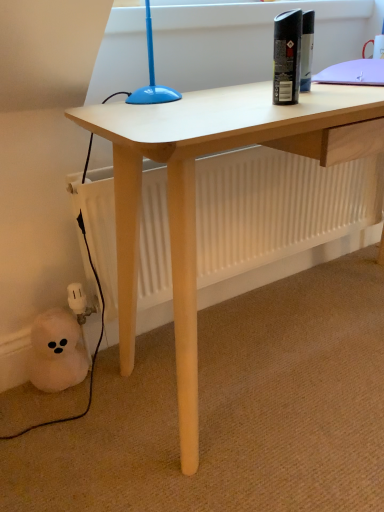
Question: From a real-world perspective, is black matte spray can at upper right over black rubber cable at lower left?

Choices:
 (A) no
 (B) yes

Answer: (B)

Question: Is black matte spray can at upper right shorter than black rubber cable at lower left?

Choices:
 (A) no
 (B) yes

Answer: (B)

Question: Is black matte spray can at upper right positioned far away from black rubber cable at lower left?

Choices:
 (A) yes
 (B) no

Answer: (B)

Question: Is black matte spray can at upper right oriented away from black rubber cable at lower left?

Choices:
 (A) yes
 (B) no

Answer: (B)

Question: Considering the relative positions of black matte spray can at upper right and black rubber cable at lower left in the image provided, is black matte spray can at upper right behind black rubber cable at lower left?

Choices:
 (A) yes
 (B) no

Answer: (B)

Question: From a real-world perspective, is black matte spray can at upper right below black rubber cable at lower left?

Choices:
 (A) no
 (B) yes

Answer: (A)

Question: Can you confirm if black rubber cable at lower left is wider than black matte spray can at upper right?

Choices:
 (A) yes
 (B) no

Answer: (A)

Question: Is black rubber cable at lower left bigger than black matte spray can at upper right?

Choices:
 (A) no
 (B) yes

Answer: (B)

Question: Is black rubber cable at lower left to the right of black matte spray can at upper right from the viewer's perspective?

Choices:
 (A) yes
 (B) no

Answer: (B)

Question: Can you confirm if black rubber cable at lower left is positioned to the left of black matte spray can at upper right?

Choices:
 (A) yes
 (B) no

Answer: (A)

Question: Is black rubber cable at lower left positioned with its back to black matte spray can at upper right?

Choices:
 (A) yes
 (B) no

Answer: (B)

Question: Does black rubber cable at lower left lie in front of black matte spray can at upper right?

Choices:
 (A) yes
 (B) no

Answer: (B)

Question: Considering the positions of point (49, 421) and point (292, 73), is point (49, 421) closer or farther from the camera than point (292, 73)?

Choices:
 (A) closer
 (B) farther

Answer: (B)